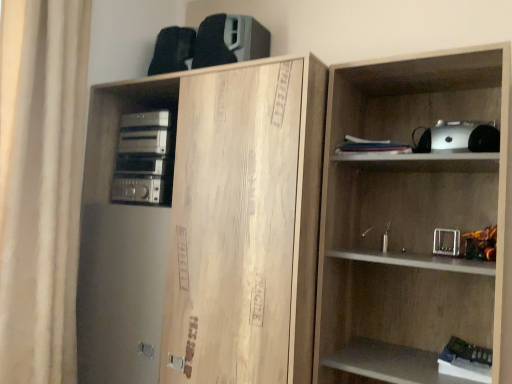
Question: From a real-world perspective, is silver metallic stereo at left positioned under white fabric curtain at left based on gravity?

Choices:
 (A) no
 (B) yes

Answer: (A)

Question: From a real-world perspective, is silver metallic stereo at left physically above white fabric curtain at left?

Choices:
 (A) yes
 (B) no

Answer: (A)

Question: Is silver metallic stereo at left shorter than white fabric curtain at left?

Choices:
 (A) no
 (B) yes

Answer: (B)

Question: Is silver metallic stereo at left at the left side of white fabric curtain at left?

Choices:
 (A) yes
 (B) no

Answer: (B)

Question: Is silver metallic stereo at left closer to the viewer compared to white fabric curtain at left?

Choices:
 (A) no
 (B) yes

Answer: (A)

Question: Would you say white fabric curtain at left is to the left or to the right of white paper stack at upper center, which is the 1th book in top-to-bottom order, in the picture?

Choices:
 (A) left
 (B) right

Answer: (A)

Question: In the image, is white fabric curtain at left positioned in front of or behind white paper stack at upper center, which is the 1th book in top-to-bottom order?

Choices:
 (A) behind
 (B) front

Answer: (B)

Question: Is point (44, 94) positioned closer to the camera than point (404, 148)?

Choices:
 (A) closer
 (B) farther

Answer: (B)

Question: From a real-world perspective, is white fabric curtain at left positioned above or below white paper stack at upper center, which is the 1th book in top-to-bottom order?

Choices:
 (A) below
 (B) above

Answer: (A)

Question: From a real-world perspective, is natural wood cabinet at upper left above or below white paper stack at upper center, the 2th book ordered from the bottom?

Choices:
 (A) above
 (B) below

Answer: (B)

Question: Based on their positions, is natural wood cabinet at upper left located to the left or right of white paper stack at upper center, positioned as the second book in right-to-left order?

Choices:
 (A) right
 (B) left

Answer: (B)

Question: In terms of width, does natural wood cabinet at upper left look wider or thinner when compared to white paper stack at upper center, the 2th book ordered from the bottom?

Choices:
 (A) thin
 (B) wide

Answer: (B)

Question: Which is correct: natural wood cabinet at upper left is inside white paper stack at upper center, positioned as the second book in right-to-left order, or outside of it?

Choices:
 (A) outside
 (B) inside

Answer: (A)

Question: From a real-world perspective, is silver metallic stereo at left above or below white fabric curtain at left?

Choices:
 (A) below
 (B) above

Answer: (B)

Question: Is silver metallic stereo at left inside the boundaries of white fabric curtain at left, or outside?

Choices:
 (A) inside
 (B) outside

Answer: (B)